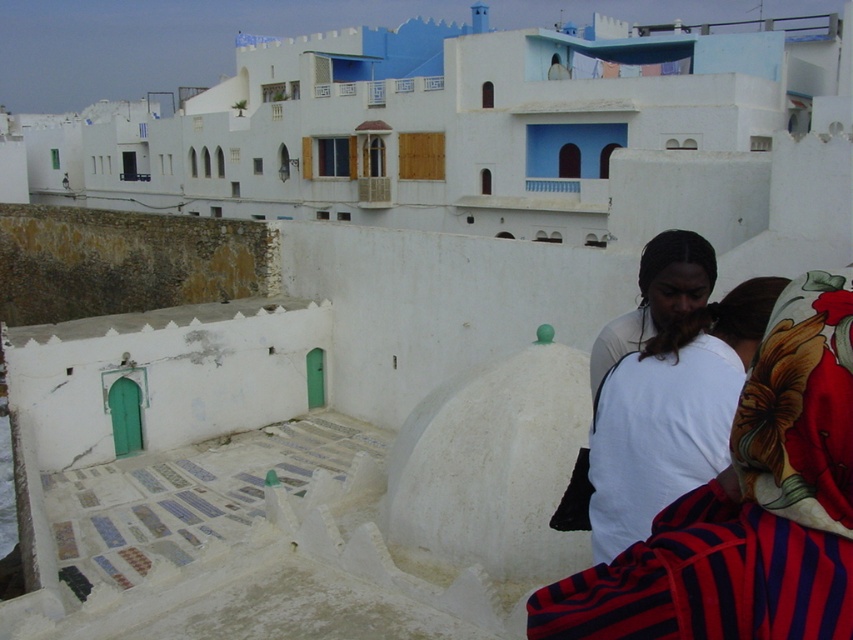
You are a photographer standing at the top of the staircase in the image. You want to capture a photo that includes both the floral fabric headscarf at right and the white cotton shirt at right. Which object should you focus on first to ensure both are in frame?

The floral fabric headscarf at right is larger in size than the white cotton shirt at right, so you should focus on the floral fabric headscarf at right first to ensure both are in frame.

You are standing at the lower area where the group of people is gathered and want to reach the higher level. You see two points marked in the scene, point 1 at coordinates (553, 598) and point 2 at coordinates (677, 365). Which point should you head towards to ascend the staircase?

You should head towards point 2 at coordinates (677, 365) because it is behind point 1 at coordinates (553, 598), meaning it is closer to the higher level where the staircase leads.